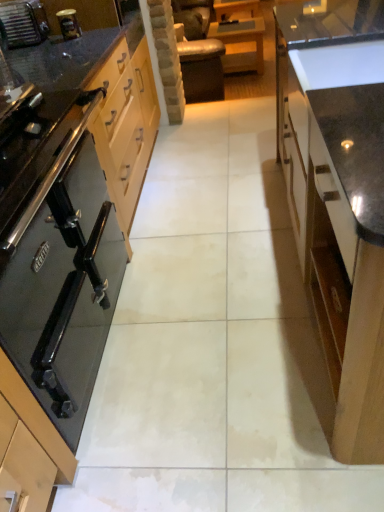
Question: Is glossy wood cabinet at right, which is the second cabinetry from left to right, positioned beyond the bounds of brushed metal toaster at upper left?

Choices:
 (A) no
 (B) yes

Answer: (B)

Question: Considering the relative sizes of glossy wood cabinet at right, which ranks as the first cabinetry in right-to-left order, and brushed metal toaster at upper left in the image provided, is glossy wood cabinet at right, which ranks as the first cabinetry in right-to-left order, bigger than brushed metal toaster at upper left?

Choices:
 (A) no
 (B) yes

Answer: (B)

Question: Considering the relative positions of glossy wood cabinet at right, which ranks as the first cabinetry in right-to-left order, and brushed metal toaster at upper left in the image provided, is glossy wood cabinet at right, which ranks as the first cabinetry in right-to-left order, to the left of brushed metal toaster at upper left from the viewer's perspective?

Choices:
 (A) no
 (B) yes

Answer: (A)

Question: Does glossy wood cabinet at right, which ranks as the first cabinetry in right-to-left order, have a greater width compared to brushed metal toaster at upper left?

Choices:
 (A) no
 (B) yes

Answer: (B)

Question: Could you tell me if glossy wood cabinet at right, which ranks as the first cabinetry in right-to-left order, is facing brushed metal toaster at upper left?

Choices:
 (A) no
 (B) yes

Answer: (A)

Question: From a real-world perspective, is glossy wood cabinet at right, which ranks as the first cabinetry in right-to-left order, on top of brushed metal toaster at upper left?

Choices:
 (A) no
 (B) yes

Answer: (A)

Question: Can you confirm if brushed metal toaster at upper left is positioned to the left of glossy wood cabinet at right, which is the second cabinetry from left to right?

Choices:
 (A) no
 (B) yes

Answer: (B)

Question: Is brushed metal toaster at upper left outside of glossy wood cabinet at right, which ranks as the first cabinetry in right-to-left order?

Choices:
 (A) no
 (B) yes

Answer: (B)

Question: Is brushed metal toaster at upper left next to glossy wood cabinet at right, which ranks as the first cabinetry in right-to-left order?

Choices:
 (A) yes
 (B) no

Answer: (B)

Question: Does brushed metal toaster at upper left have a lesser width compared to glossy wood cabinet at right, which ranks as the first cabinetry in right-to-left order?

Choices:
 (A) yes
 (B) no

Answer: (A)

Question: From a real-world perspective, is brushed metal toaster at upper left physically below glossy wood cabinet at right, which ranks as the first cabinetry in right-to-left order?

Choices:
 (A) no
 (B) yes

Answer: (A)

Question: Can you confirm if brushed metal toaster at upper left is smaller than glossy wood cabinet at right, which is the second cabinetry from left to right?

Choices:
 (A) no
 (B) yes

Answer: (B)

Question: Does black glass stove at left, which is the first cabinetry from left to right, contain brushed metal toaster at upper left?

Choices:
 (A) no
 (B) yes

Answer: (A)